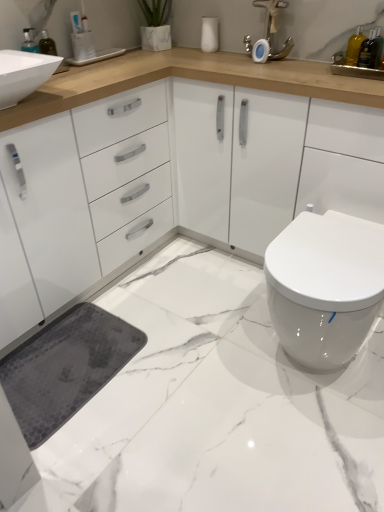
The width and height of the screenshot is (384, 512). What do you see at coordinates (324, 286) in the screenshot?
I see `white glossy toilet at lower right` at bounding box center [324, 286].

What is the approximate height of matte silver faucet at upper center?

10.51 inches.

Measure the distance between point (274, 22) and camera.

They are 1.72 meters apart.

What do you see at coordinates (217, 410) in the screenshot?
I see `white marble floor at lower right` at bounding box center [217, 410].

Measure the distance between point (363, 47) and camera.

The depth of point (363, 47) is 1.49 meters.

The width and height of the screenshot is (384, 512). What do you see at coordinates (76, 22) in the screenshot?
I see `blue plastic toothbrush at upper left, placed as the 1th toiletry when sorted from back to front` at bounding box center [76, 22].

Image resolution: width=384 pixels, height=512 pixels. I want to click on white glossy toilet at lower right, so (324, 286).

Which point is more forward, (26, 79) or (373, 62)?

The point (26, 79) is in front.

Would you consider white glossy sink at upper left, the first sink in the left-to-right sequence, to be distant from translucent glass bottle at upper right, the 2th sink from the left?

Indeed, white glossy sink at upper left, the first sink in the left-to-right sequence, is not near translucent glass bottle at upper right, the 2th sink from the left.

From the image's perspective, who appears lower, white glossy sink at upper left, the first sink in the left-to-right sequence, or translucent glass bottle at upper right, the 2th sink from the left?

white glossy sink at upper left, the first sink in the left-to-right sequence, appears lower in the image.

Can we say white glossy sink at upper left, the first sink in the left-to-right sequence, lies outside translucent glass bottle at upper right, the 2th sink from the left?

Yes, white glossy sink at upper left, the first sink in the left-to-right sequence, is not within translucent glass bottle at upper right, the 2th sink from the left.

Can you confirm if white glossy toilet at lower right is positioned to the right of translucent glass bottle at upper right, the 2th sink from the left?

No.

In the scene shown: Is white glossy toilet at lower right closer to the viewer compared to translucent glass bottle at upper right, which is counted as the 1th sink, starting from the right?

That is True.

Is translucent glass bottle at upper right, the 2th sink from the left, completely or partially inside white glossy toilet at lower right?

No, translucent glass bottle at upper right, the 2th sink from the left, is not surrounded by white glossy toilet at lower right.

From the image's perspective, is white glossy toilet at lower right located above translucent glass bottle at upper right, arranged as the second toiletry when viewed from the back?

No, from the image's perspective, white glossy toilet at lower right is not over translucent glass bottle at upper right, arranged as the second toiletry when viewed from the back.

Considering the positions of point (325, 338) and point (369, 55), is point (325, 338) closer or farther from the camera than point (369, 55)?

Point (325, 338).

Could you tell me if white glossy toilet at lower right is turned towards translucent glass bottle at upper right, the 2th toiletry positioned from the left?

No.

How far apart are white glossy toilet at lower right and translucent glass bottle at upper right, the first toiletry in the front-to-back sequence?

They are 30.99 inches apart.

From the image's perspective, between blue plastic toothbrush at upper left, the first toiletry from the top, and translucent glass bottle at upper right, which is counted as the 1th sink, starting from the right, which one is located above?

blue plastic toothbrush at upper left, the first toiletry from the top, from the image's perspective.

Is blue plastic toothbrush at upper left, the 1th toiletry from the left, taller than translucent glass bottle at upper right, which is counted as the 1th sink, starting from the right?

No, blue plastic toothbrush at upper left, the 1th toiletry from the left, is not taller than translucent glass bottle at upper right, which is counted as the 1th sink, starting from the right.

Is blue plastic toothbrush at upper left, arranged as the 2th toiletry when viewed from the front, to the right of translucent glass bottle at upper right, the 2th sink from the left, from the viewer's perspective?

No, blue plastic toothbrush at upper left, arranged as the 2th toiletry when viewed from the front, is not to the right of translucent glass bottle at upper right, the 2th sink from the left.

Considering the sizes of objects blue plastic toothbrush at upper left, the 1th toiletry from the left, and translucent glass bottle at upper right, which is counted as the 1th sink, starting from the right, in the image provided, who is thinner, blue plastic toothbrush at upper left, the 1th toiletry from the left, or translucent glass bottle at upper right, which is counted as the 1th sink, starting from the right,?

With smaller width is blue plastic toothbrush at upper left, the 1th toiletry from the left.

Considering the sizes of white marble floor at lower right and matte silver faucet at upper center in the image, is white marble floor at lower right taller or shorter than matte silver faucet at upper center?

Considering their sizes, white marble floor at lower right has less height than matte silver faucet at upper center.

How different are the orientations of white marble floor at lower right and matte silver faucet at upper center in degrees?

90.5 degrees separate the facing orientations of white marble floor at lower right and matte silver faucet at upper center.

How distant is white marble floor at lower right from matte silver faucet at upper center?

white marble floor at lower right is 1.25 meters away from matte silver faucet at upper center.

Which is more to the right, white marble floor at lower right or matte silver faucet at upper center?

matte silver faucet at upper center.

Considering the positions of points (367, 42) and (354, 44), is point (367, 42) farther from camera compared to point (354, 44)?

No, (367, 42) is closer to viewer.

From a real-world perspective, which toiletry is the 1st one above the translucent glass bottle at upper right, the 2th sink from the left? Please provide its 2D coordinates.

[(370, 50)]

Who is shorter, translucent glass bottle at upper right, the 2th toiletry positioned from the left, or translucent glass bottle at upper right, the 2th sink from the left?

Standing shorter between the two is translucent glass bottle at upper right, the 2th sink from the left.

Can you tell me how much translucent glass bottle at upper right, acting as the 1th toiletry starting from the bottom, and translucent glass bottle at upper right, the 2th sink from the left, differ in facing direction?

The angle between the facing direction of translucent glass bottle at upper right, acting as the 1th toiletry starting from the bottom, and the facing direction of translucent glass bottle at upper right, the 2th sink from the left, is 0.00125 degrees.

Can we say white marble floor at lower right lies outside white glossy sink at upper left, the second sink when ordered from right to left?

white marble floor at lower right is positioned outside white glossy sink at upper left, the second sink when ordered from right to left.

Is point (156, 462) more distant than point (25, 90)?

No, it is not.

In the image, is white marble floor at lower right on the left side or the right side of white glossy sink at upper left, the second sink when ordered from right to left?

From the image, it's evident that white marble floor at lower right is to the right of white glossy sink at upper left, the second sink when ordered from right to left.

This screenshot has width=384, height=512. I want to click on sink that appears on the right of white glossy sink at upper left, the second sink when ordered from right to left, so click(361, 56).

This screenshot has width=384, height=512. In the image, there is a translucent glass bottle at upper right, the 2th sink from the left. Find the location of `toilet below it (from a real-world perspective)`. toilet below it (from a real-world perspective) is located at coordinates (324, 286).

Considering their positions, is white glossy sink at upper left, the first sink in the left-to-right sequence, positioned closer to white glossy toilet at lower right than translucent glass bottle at upper right, the 2th toiletry positioned from the left?

Based on the image, translucent glass bottle at upper right, the 2th toiletry positioned from the left, appears to be nearer to white glossy toilet at lower right.

Considering their positions, is blue plastic toothbrush at upper left, arranged as the 2th toiletry when viewed from the front, positioned closer to translucent glass bottle at upper right, acting as the 1th toiletry starting from the bottom, than translucent glass bottle at upper right, the 2th sink from the left?

translucent glass bottle at upper right, the 2th sink from the left, is closer to translucent glass bottle at upper right, acting as the 1th toiletry starting from the bottom.

When comparing their distances from white glossy toilet at lower right, does matte silver faucet at upper center or white marble floor at lower right seem further?

matte silver faucet at upper center lies further to white glossy toilet at lower right than the other object.

Estimate the real-world distances between objects in this image. Which object is further from translucent glass bottle at upper right, the first toiletry in the front-to-back sequence, matte silver faucet at upper center or white glossy sink at upper left, the first sink in the left-to-right sequence?

white glossy sink at upper left, the first sink in the left-to-right sequence.

Which object lies further to the anchor point blue plastic toothbrush at upper left, the first toiletry from the top, translucent glass bottle at upper right, the 2th sink from the left, or translucent glass bottle at upper right, the first toiletry in the front-to-back sequence?

Based on the image, translucent glass bottle at upper right, the first toiletry in the front-to-back sequence, appears to be further to blue plastic toothbrush at upper left, the first toiletry from the top.

Considering their positions, is matte silver faucet at upper center positioned further to blue plastic toothbrush at upper left, which ranks as the 2th toiletry in right-to-left order, than white marble floor at lower right?

white marble floor at lower right lies further to blue plastic toothbrush at upper left, which ranks as the 2th toiletry in right-to-left order, than the other object.

When comparing their distances from translucent glass bottle at upper right, acting as the 1th toiletry starting from the bottom, does matte silver faucet at upper center or white marble floor at lower right seem closer?

Among the two, matte silver faucet at upper center is located nearer to translucent glass bottle at upper right, acting as the 1th toiletry starting from the bottom.

Looking at the image, which one is located further to white marble floor at lower right, white glossy toilet at lower right or matte silver faucet at upper center?

matte silver faucet at upper center is positioned further to the anchor white marble floor at lower right.

Find the location of `toiletry between white glossy sink at upper left, the first sink in the left-to-right sequence, and white glossy toilet at lower right`. toiletry between white glossy sink at upper left, the first sink in the left-to-right sequence, and white glossy toilet at lower right is located at coordinates (76, 22).

Identify the location of faucet between white glossy sink at upper left, the second sink when ordered from right to left, and translucent glass bottle at upper right, the 2th sink from the left. This screenshot has width=384, height=512. (274, 27).

The image size is (384, 512). I want to click on sink that lies between translucent glass bottle at upper right, the 2th sink from the left, and white marble floor at lower right from top to bottom, so click(x=23, y=74).

At what (x,y) coordinates should I click in order to perform the action: click on sink between white glossy sink at upper left, the second sink when ordered from right to left, and translucent glass bottle at upper right, the 1th toiletry positioned from the right, from left to right. Please return your answer as a coordinate pair (x, y). Looking at the image, I should click on (361, 56).